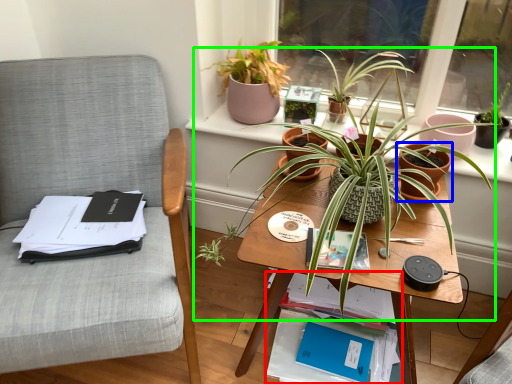
Question: Which object is positioned closest to book (highlighted by a red box)? Select from flowerpot (highlighted by a blue box) and houseplant (highlighted by a green box).

Choices:
 (A) flowerpot
 (B) houseplant

Answer: (B)